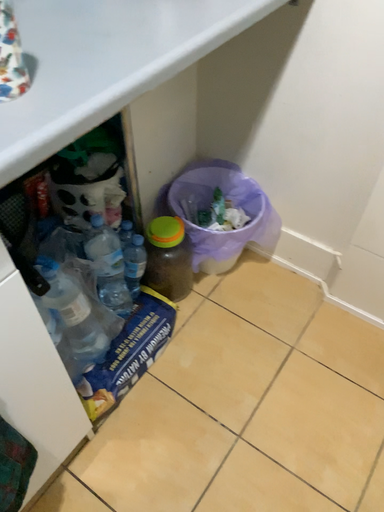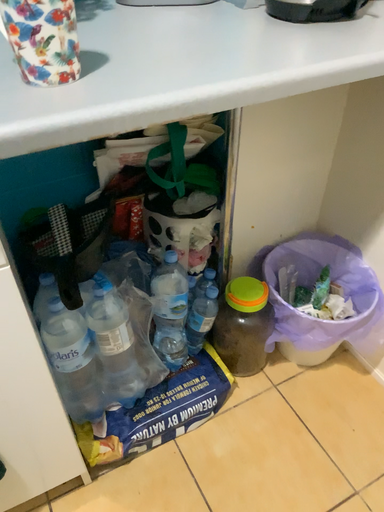
Question: How did the camera likely rotate when shooting the video?

Choices:
 (A) rotated left
 (B) rotated right

Answer: (A)